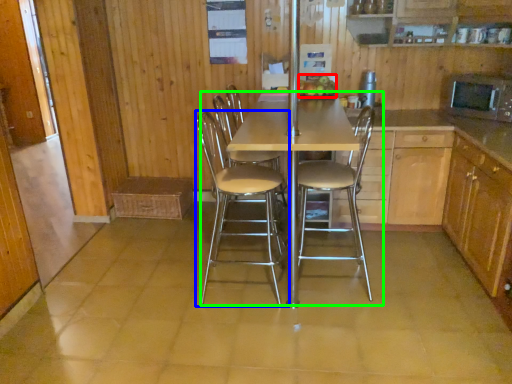
Question: Which is farther away from fruit (highlighted by a red box)? chair (highlighted by a blue box) or kitchen & dining room table (highlighted by a green box)?

Choices:
 (A) chair
 (B) kitchen & dining room table

Answer: (A)